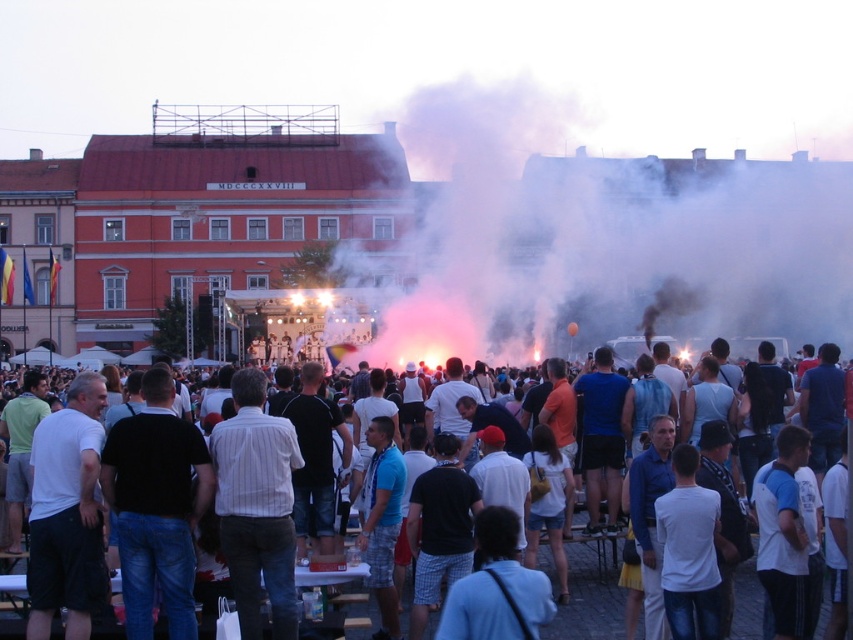
You are standing in the public square and want to take a photo of both the point at coordinates (502, 232) and the point at coordinates (606, 547). Which point should you focus on first to ensure both are in focus?

You should focus on the point at coordinates (502, 232) first because it is closer to the camera than the point at coordinates (606, 547). This ensures both points will be in focus when using depth of field.

You are standing in the public square in front of the building with the red facade. There is a pink smoke at center. Can you estimate the coordinates of the pink smoke relative to the square?

The pink smoke at center is located at point coordinates of 0.377 on the x axis and 0.716 on the y axis.

You are at the event and want to take a photo of the white cotton crowd at center without the pink smoke at center appearing in the shot. Which direction should you move to achieve this?

Move to the left of the white cotton crowd at center so that the pink smoke at center is no longer in the frame.